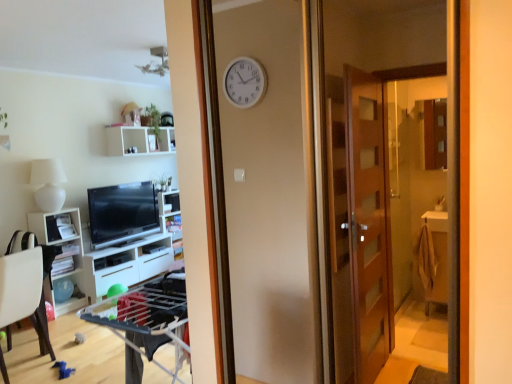
The height and width of the screenshot is (384, 512). What do you see at coordinates (170, 219) in the screenshot? I see `white glossy shelf at center, which is the 3th shelf in top-to-bottom order` at bounding box center [170, 219].

What is the approximate width of white glossy shelf at center, the first shelf in the bottom-to-top sequence?

white glossy shelf at center, the first shelf in the bottom-to-top sequence, is 12.37 inches wide.

The width and height of the screenshot is (512, 384). What are the coordinates of `white matte shelf at upper center, marked as the third shelf in a bottom-to-top arrangement` in the screenshot? It's located at (138, 140).

The image size is (512, 384). What do you see at coordinates (126, 264) in the screenshot? I see `white glossy cabinet at lower left, the second cabinetry when ordered from front to back` at bounding box center [126, 264].

Describe the element at coordinates (169, 202) in the screenshot. The width and height of the screenshot is (512, 384). I see `white glossy shelf at center, which is the second shelf from bottom to top` at that location.

Find the location of a particular element. white glossy cabinet at left, which is counted as the second cabinetry, starting from the back is located at coordinates (62, 253).

Can you confirm if white glossy cabinet at lower left, the second cabinetry when ordered from front to back, is smaller than white glossy shelf at center, which appears as the second shelf when viewed from the top?

No, white glossy cabinet at lower left, the second cabinetry when ordered from front to back, is not smaller than white glossy shelf at center, which appears as the second shelf when viewed from the top.

From the image's perspective, which one is positioned lower, white glossy cabinet at lower left, the second cabinetry when ordered from front to back, or white glossy shelf at center, which appears as the second shelf when viewed from the top?

From the image's view, white glossy cabinet at lower left, the second cabinetry when ordered from front to back, is below.

Is white glossy cabinet at lower left, positioned as the first cabinetry in back-to-front order, to the left of white glossy shelf at center, which appears as the second shelf when viewed from the top, from the viewer's perspective?

Correct, you'll find white glossy cabinet at lower left, positioned as the first cabinetry in back-to-front order, to the left of white glossy shelf at center, which appears as the second shelf when viewed from the top.

Is white glossy cabinet at lower left, positioned as the first cabinetry in back-to-front order, aimed at white glossy shelf at center, which appears as the second shelf when viewed from the top?

A: No, white glossy cabinet at lower left, positioned as the first cabinetry in back-to-front order, is not facing towards white glossy shelf at center, which appears as the second shelf when viewed from the top.

Which object is closer to the camera taking this photo, white matte lamp at left or matte black tv at left?

white matte lamp at left is closer to the camera.

Which is behind, point (31, 176) or point (139, 223)?

Positioned behind is point (139, 223).

From a real-world perspective, does white matte lamp at left stand above matte black tv at left?

Yes.

Considering the relative sizes of white matte lamp at left and matte black tv at left in the image provided, is white matte lamp at left thinner than matte black tv at left?

In fact, white matte lamp at left might be wider than matte black tv at left.

What are the coordinates of `lamp above the white glossy cabinet at lower left, the second cabinetry when ordered from front to back (from a real-world perspective)` in the screenshot? It's located at (48, 184).

Based on the photo, from a real-world perspective, is white matte lamp at left physically below white glossy cabinet at lower left, positioned as the first cabinetry in back-to-front order?

No, from a real-world perspective, white matte lamp at left is not beneath white glossy cabinet at lower left, positioned as the first cabinetry in back-to-front order.

Which object is more forward, white matte lamp at left or white glossy cabinet at lower left, the second cabinetry when ordered from front to back?

white matte lamp at left is more forward.

Considering the positions of points (35, 164) and (91, 278), is point (35, 164) farther from camera compared to point (91, 278)?

No, (35, 164) is in front of (91, 278).

Can you see white glossy cabinet at lower left, positioned as the first cabinetry in back-to-front order, touching white glossy cabinet at left, which is counted as the second cabinetry, starting from the back?

No, white glossy cabinet at lower left, positioned as the first cabinetry in back-to-front order, is not making contact with white glossy cabinet at left, which is counted as the second cabinetry, starting from the back.

What's the angular difference between white glossy cabinet at lower left, the second cabinetry when ordered from front to back, and white glossy cabinet at left, positioned as the 1th cabinetry in front-to-back order,'s facing directions?

0.272 degrees separate the facing orientations of white glossy cabinet at lower left, the second cabinetry when ordered from front to back, and white glossy cabinet at left, positioned as the 1th cabinetry in front-to-back order.

Is point (89, 264) closer or farther from the camera than point (50, 297)?

Point (89, 264) appears to be farther away from the viewer than point (50, 297).

Which of these two, white glossy cabinet at lower left, positioned as the first cabinetry in back-to-front order, or white glossy cabinet at left, which is counted as the second cabinetry, starting from the back, stands taller?

Standing taller between the two is white glossy cabinet at left, which is counted as the second cabinetry, starting from the back.

From the picture: From a real-world perspective, is white glossy shelf at center, which is the second shelf from bottom to top, on top of white matte shelf at upper center, marked as the third shelf in a bottom-to-top arrangement?

No, from a real-world perspective, white glossy shelf at center, which is the second shelf from bottom to top, is not on top of white matte shelf at upper center, marked as the third shelf in a bottom-to-top arrangement.

From the image's perspective, which object appears higher, white glossy shelf at center, which is the second shelf from bottom to top, or white matte shelf at upper center, marked as the third shelf in a bottom-to-top arrangement?

white matte shelf at upper center, marked as the third shelf in a bottom-to-top arrangement.

Based on the photo, would you consider white glossy shelf at center, which appears as the second shelf when viewed from the top, to be distant from white matte shelf at upper center, arranged as the first shelf when viewed from the top?

white glossy shelf at center, which appears as the second shelf when viewed from the top, is actually quite close to white matte shelf at upper center, arranged as the first shelf when viewed from the top.

Based on their sizes in the image, would you say white matte lamp at left is bigger or smaller than white glossy shelf at center, which is the second shelf from bottom to top?

Clearly, white matte lamp at left is larger in size than white glossy shelf at center, which is the second shelf from bottom to top.

Looking at their sizes, would you say white matte lamp at left is wider or thinner than white glossy shelf at center, which appears as the second shelf when viewed from the top?

white matte lamp at left is wider than white glossy shelf at center, which appears as the second shelf when viewed from the top.

Is white matte lamp at left touching white glossy shelf at center, which appears as the second shelf when viewed from the top?

There is a gap between white matte lamp at left and white glossy shelf at center, which appears as the second shelf when viewed from the top.

From a real-world perspective, who is located lower, white matte lamp at left or white glossy shelf at center, which is the second shelf from bottom to top?

white glossy shelf at center, which is the second shelf from bottom to top, from a real-world perspective.

Is the surface of white glossy shelf at center, the first shelf in the bottom-to-top sequence, in direct contact with white glossy shelf at center, which is the second shelf from bottom to top?

There is a gap between white glossy shelf at center, the first shelf in the bottom-to-top sequence, and white glossy shelf at center, which is the second shelf from bottom to top.

Who is bigger, white glossy shelf at center, the first shelf in the bottom-to-top sequence, or white glossy shelf at center, which is the second shelf from bottom to top?

white glossy shelf at center, the first shelf in the bottom-to-top sequence, is bigger.

Considering the positions of point (179, 254) and point (172, 203), is point (179, 254) closer or farther from the camera than point (172, 203)?

Clearly, point (179, 254) is closer to the camera than point (172, 203).

Identify the location of the 2nd cabinetry below the white glossy shelf at center, which appears as the second shelf when viewed from the top (from the image's perspective). The width and height of the screenshot is (512, 384). [x=126, y=264].

In order to click on lamp above the matte black tv at left (from a real-world perspective) in this screenshot , I will do `click(48, 184)`.

Based on their spatial positions, is white glossy cabinet at lower left, the second cabinetry when ordered from front to back, or white plastic chair at lower left closer to white glossy cabinet at left, positioned as the 1th cabinetry in front-to-back order?

white glossy cabinet at lower left, the second cabinetry when ordered from front to back, is positioned closer to the anchor white glossy cabinet at left, positioned as the 1th cabinetry in front-to-back order.

Looking at the image, which one is located further to white plastic chair at lower left, white glossy shelf at center, the first shelf in the bottom-to-top sequence, or matte black tv at left?

white glossy shelf at center, the first shelf in the bottom-to-top sequence, is further to white plastic chair at lower left.

Estimate the real-world distances between objects in this image. Which object is closer to white matte lamp at left, white matte shelf at upper center, marked as the third shelf in a bottom-to-top arrangement, or white glossy cabinet at left, which is counted as the second cabinetry, starting from the back?

Based on the image, white glossy cabinet at left, which is counted as the second cabinetry, starting from the back, appears to be nearer to white matte lamp at left.

Considering their positions, is white glossy shelf at center, which appears as the second shelf when viewed from the top, positioned further to white glossy cabinet at lower left, positioned as the first cabinetry in back-to-front order, than white matte lamp at left?

white matte lamp at left is positioned further to the anchor white glossy cabinet at lower left, positioned as the first cabinetry in back-to-front order.

When comparing their distances from white plastic chair at lower left, does white matte shelf at upper center, arranged as the first shelf when viewed from the top, or matte black tv at left seem closer?

Based on the image, matte black tv at left appears to be nearer to white plastic chair at lower left.

Estimate the real-world distances between objects in this image. Which object is further from matte black tv at left, white glossy cabinet at left, which is counted as the second cabinetry, starting from the back, or white glossy shelf at center, which is the 3th shelf in top-to-bottom order?

white glossy shelf at center, which is the 3th shelf in top-to-bottom order, is positioned further to the anchor matte black tv at left.

Based on their spatial positions, is matte black tv at left or white glossy shelf at center, the first shelf in the bottom-to-top sequence, further from white glossy cabinet at left, which is counted as the second cabinetry, starting from the back?

white glossy shelf at center, the first shelf in the bottom-to-top sequence, is positioned further to the anchor white glossy cabinet at left, which is counted as the second cabinetry, starting from the back.

Considering their positions, is white matte lamp at left positioned further to matte black tv at left than white matte shelf at upper center, arranged as the first shelf when viewed from the top?

white matte shelf at upper center, arranged as the first shelf when viewed from the top, lies further to matte black tv at left than the other object.

The width and height of the screenshot is (512, 384). In order to click on lamp between white plastic chair at lower left and white glossy shelf at center, the first shelf in the bottom-to-top sequence, in the front-back direction in this screenshot , I will do `click(48, 184)`.

The height and width of the screenshot is (384, 512). Find the location of `television between white matte shelf at upper center, marked as the third shelf in a bottom-to-top arrangement, and white glossy cabinet at lower left, the second cabinetry when ordered from front to back, in the vertical direction`. television between white matte shelf at upper center, marked as the third shelf in a bottom-to-top arrangement, and white glossy cabinet at lower left, the second cabinetry when ordered from front to back, in the vertical direction is located at coordinates pos(122,213).

Locate an element on the screen. cabinetry that lies between white matte shelf at upper center, arranged as the first shelf when viewed from the top, and white glossy cabinet at lower left, the second cabinetry when ordered from front to back, from top to bottom is located at coordinates (62, 253).

This screenshot has height=384, width=512. Identify the location of cabinetry located between white plastic chair at lower left and white glossy cabinet at lower left, positioned as the first cabinetry in back-to-front order, in the depth direction. (62, 253).